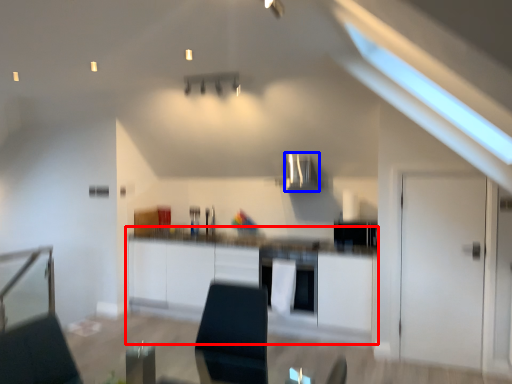
Question: Among these objects, which one is nearest to the camera, cabinetry (highlighted by a red box) or exhaust hood (highlighted by a blue box)?

Choices:
 (A) cabinetry
 (B) exhaust hood

Answer: (A)